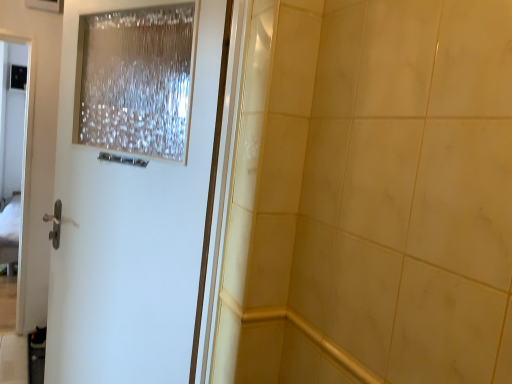
At what (x,y) coordinates should I click in order to perform the action: click on white glossy door at left. Please return your answer as a coordinate pair (x, y). This screenshot has width=512, height=384. Looking at the image, I should click on (132, 187).

Image resolution: width=512 pixels, height=384 pixels. What do you see at coordinates (132, 187) in the screenshot?
I see `white glossy door at left` at bounding box center [132, 187].

The width and height of the screenshot is (512, 384). I want to click on white glossy door at left, so click(x=132, y=187).